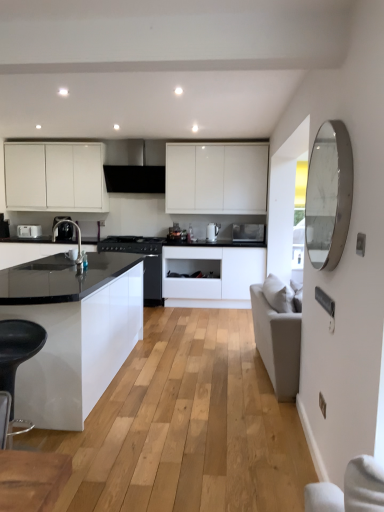
Question: From the image's perspective, is silver/metallic mirror at right under matte white toaster at left, the 2th kitchen appliance viewed from the front?

Choices:
 (A) no
 (B) yes

Answer: (B)

Question: Is silver/metallic mirror at right shorter than matte white toaster at left, which is the 1th kitchen appliance from back to front?

Choices:
 (A) yes
 (B) no

Answer: (B)

Question: Can you confirm if silver/metallic mirror at right is wider than matte white toaster at left, which is counted as the second kitchen appliance, starting from the right?

Choices:
 (A) no
 (B) yes

Answer: (A)

Question: Is silver/metallic mirror at right far away from matte white toaster at left, acting as the first kitchen appliance starting from the left?

Choices:
 (A) no
 (B) yes

Answer: (B)

Question: Is silver/metallic mirror at right bigger than matte white toaster at left, the 2th kitchen appliance viewed from the front?

Choices:
 (A) yes
 (B) no

Answer: (A)

Question: Based on their sizes in the image, would you say black plastic bar stool at lower left is bigger or smaller than satin black coffee machine at left?

Choices:
 (A) big
 (B) small

Answer: (A)

Question: In terms of height, does black plastic bar stool at lower left look taller or shorter compared to satin black coffee machine at left?

Choices:
 (A) tall
 (B) short

Answer: (A)

Question: Considering the positions of point (11, 426) and point (66, 231), is point (11, 426) closer or farther from the camera than point (66, 231)?

Choices:
 (A) farther
 (B) closer

Answer: (B)

Question: From a real-world perspective, is black plastic bar stool at lower left above or below satin black coffee machine at left?

Choices:
 (A) below
 (B) above

Answer: (A)

Question: Is black matte exhaust hood at upper center bigger or smaller than white glossy kettle at center, which is counted as the second kitchen appliance, starting from the back?

Choices:
 (A) big
 (B) small

Answer: (A)

Question: Is black matte exhaust hood at upper center taller or shorter than white glossy kettle at center, which appears as the 2th kitchen appliance when viewed from the left?

Choices:
 (A) tall
 (B) short

Answer: (A)

Question: Does point click(162, 189) appear closer or farther from the camera than point click(215, 234)?

Choices:
 (A) closer
 (B) farther

Answer: (B)

Question: From a real-world perspective, is black matte exhaust hood at upper center above or below white glossy kettle at center, which is counted as the first kitchen appliance, starting from the front?

Choices:
 (A) above
 (B) below

Answer: (A)

Question: Do you think black matte exhaust hood at upper center is within white matte cabinet at center, arranged as the first cabinetry when ordered from the bottom, or outside of it?

Choices:
 (A) inside
 (B) outside

Answer: (B)

Question: Based on their sizes in the image, would you say black matte exhaust hood at upper center is bigger or smaller than white matte cabinet at center, which is counted as the first cabinetry, starting from the right?

Choices:
 (A) small
 (B) big

Answer: (A)